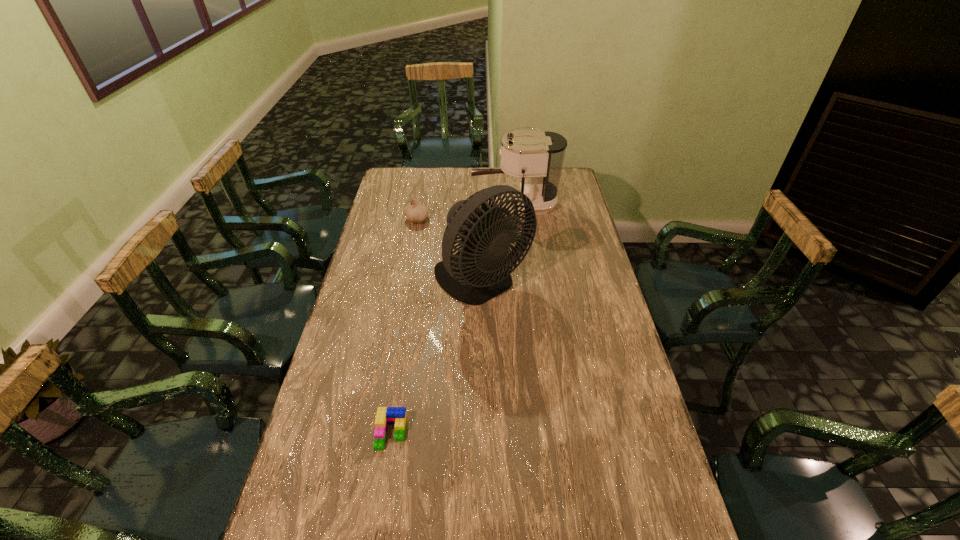
The width and height of the screenshot is (960, 540). What are the coordinates of `the tallest object` in the screenshot? It's located at click(x=479, y=271).

What are the coordinates of `fan` in the screenshot? It's located at (479, 271).

Identify the location of the second tallest object. This screenshot has height=540, width=960. (538, 155).

Identify the location of the third tallest object. The height and width of the screenshot is (540, 960). (415, 212).

Image resolution: width=960 pixels, height=540 pixels. In order to click on Lego in this screenshot , I will do `click(385, 415)`.

You are a GUI agent. You are given a task and a screenshot of the screen. Output one action in this format:
    pyautogui.click(x=<x>, y=<y>)
    Task: Click on the shortest object
    
    Given the screenshot: What is the action you would take?
    pyautogui.click(x=385, y=415)

Locate an element on the screen. vacant space situated in front of the fan to direct airflow is located at coordinates (483, 335).

At what (x,y) coordinates should I click in order to perform the action: click on free space located on the front-facing side of the third shortest object. Please return your answer as a coordinate pair (x, y). Looking at the image, I should click on (407, 206).

Where is `vacant space located on the front-facing side of the third shortest object`? vacant space located on the front-facing side of the third shortest object is located at coordinates (429, 206).

Find the location of a particular element. This screenshot has height=540, width=960. vacant space situated on the front-facing side of the third shortest object is located at coordinates (429, 206).